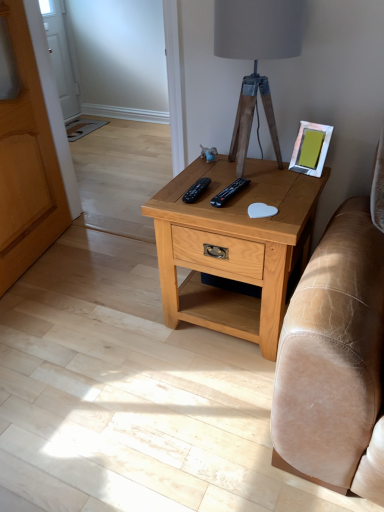
Where is `free spot to the right of black plastic remote at center, which is the 1th remote in right-to-left order`? free spot to the right of black plastic remote at center, which is the 1th remote in right-to-left order is located at coordinates (287, 188).